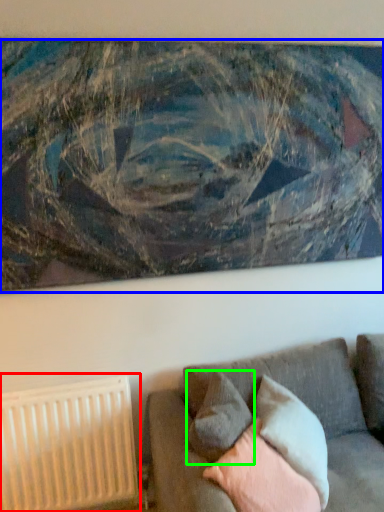
Question: Based on their relative distances, which object is nearer to radiator (highlighted by a red box)? Choose from picture frame (highlighted by a blue box) and pillow (highlighted by a green box).

Choices:
 (A) picture frame
 (B) pillow

Answer: (B)